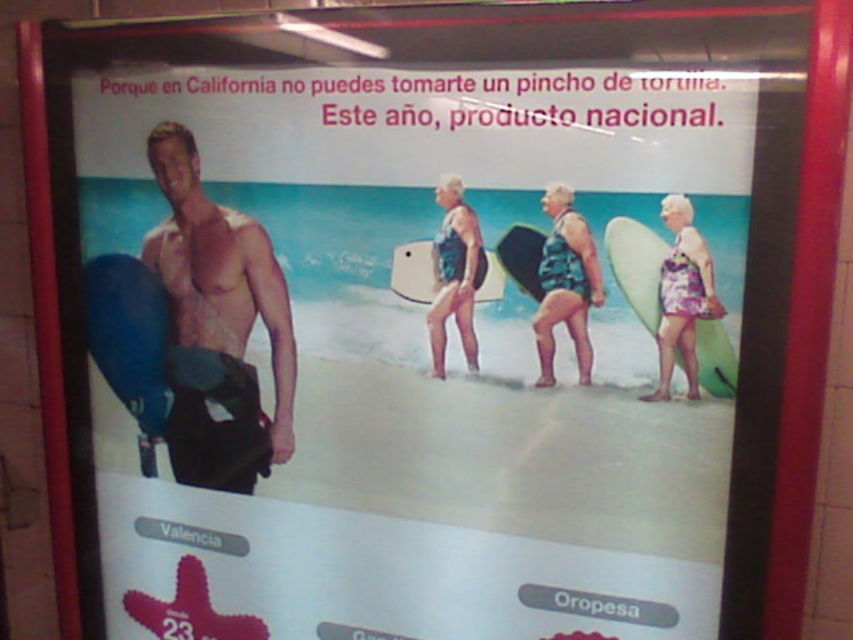
You are designing a layout for a beach advertisement poster. The poster has a red border and features a man carrying a blue surfboard and three women holding surfboards in the background. Where should you place the blue matte surfboard at left in terms of coordinates to match the original image?

The blue matte surfboard at left should be placed at coordinates point (129, 337) to match the original image.